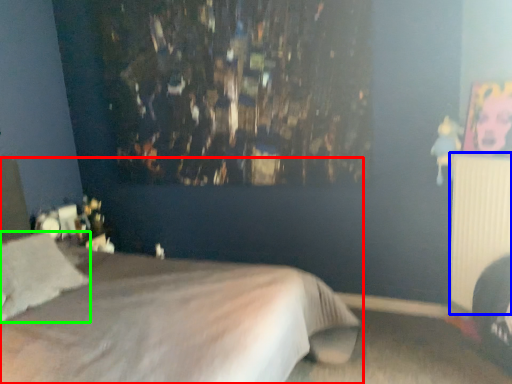
Question: Based on their relative distances, which object is farther from bed (highlighted by a red box)? Choose from radiator (highlighted by a blue box) and pillow (highlighted by a green box).

Choices:
 (A) radiator
 (B) pillow

Answer: (A)